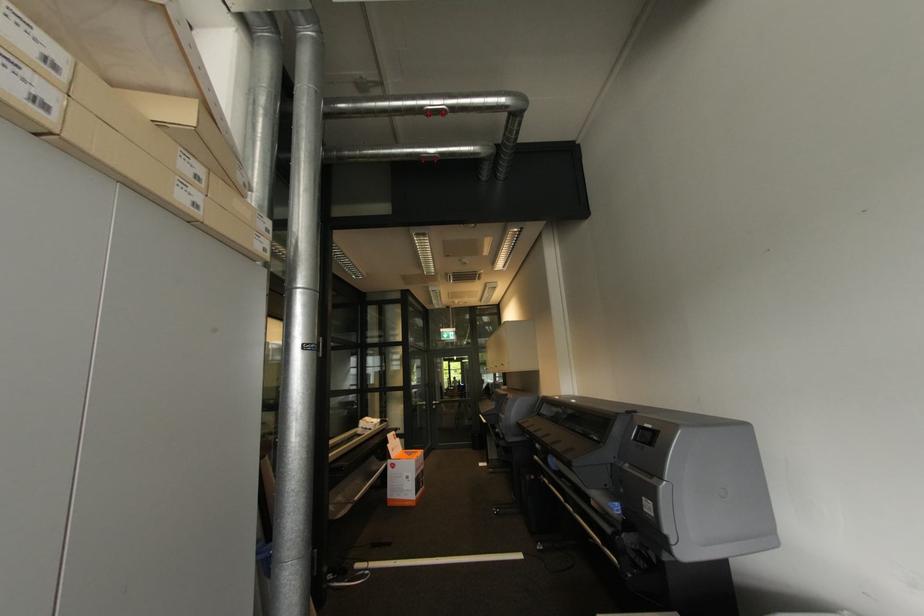
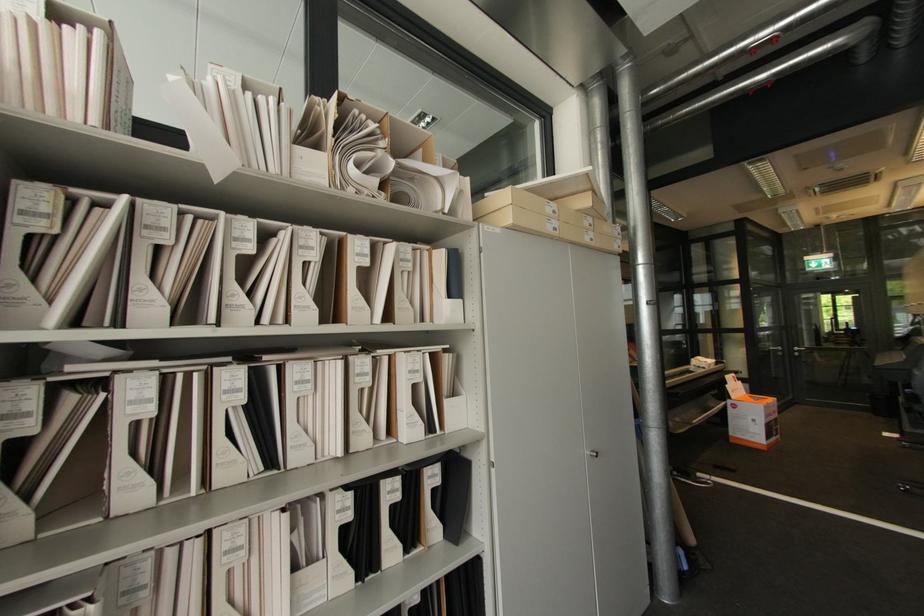
Question: Based on the continuous images, in which direction is the camera rotating? Reply with the corresponding letter.

Choices:
 (A) Left
 (B) Right
 (C) Up
 (D) Down

Answer: (A)